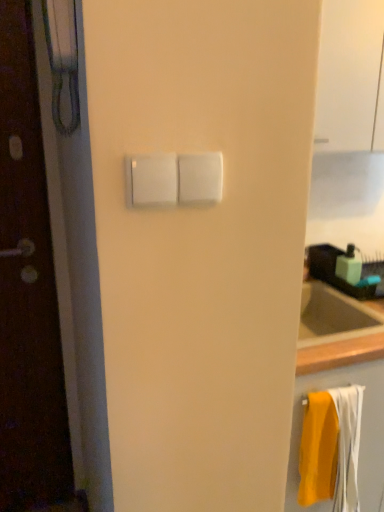
The image size is (384, 512). What do you see at coordinates (348, 73) in the screenshot?
I see `transparent glass door at upper right` at bounding box center [348, 73].

The width and height of the screenshot is (384, 512). What are the coordinates of `yellow fabric towel at lower right` in the screenshot? It's located at (331, 448).

This screenshot has height=512, width=384. In order to click on transparent glass door at upper right in this screenshot , I will do `click(348, 73)`.

Is green matte soap dispenser at upper right aimed at transparent glass door at upper right?

No, green matte soap dispenser at upper right is not aimed at transparent glass door at upper right.

Between point (358, 252) and point (342, 112), which one is positioned behind?

The point (358, 252) is behind.

From a real-world perspective, is green matte soap dispenser at upper right above or below transparent glass door at upper right?

green matte soap dispenser at upper right is situated lower than transparent glass door at upper right in the real world.

Does green matte soap dispenser at upper right have a smaller size compared to transparent glass door at upper right?

Correct, green matte soap dispenser at upper right occupies less space than transparent glass door at upper right.

From the image's perspective, which one is positioned lower, green matte soap dispenser at upper right or white plastic light switch at center?

green matte soap dispenser at upper right appears lower in the image.

Which of these two, green matte soap dispenser at upper right or white plastic light switch at center, is thinner?

white plastic light switch at center.

How many degrees apart are the facing directions of green matte soap dispenser at upper right and white plastic light switch at center?

green matte soap dispenser at upper right and white plastic light switch at center are facing 3.77 degrees away from each other.

Is green matte soap dispenser at upper right smaller than white plastic light switch at center?

No, green matte soap dispenser at upper right is not smaller than white plastic light switch at center.

Between transparent glass door at upper right and yellow fabric towel at lower right, which one appears on the left side from the viewer's perspective?

Positioned to the left is yellow fabric towel at lower right.

Where is `glass door located above the yellow fabric towel at lower right (from a real-world perspective)`? Image resolution: width=384 pixels, height=512 pixels. glass door located above the yellow fabric towel at lower right (from a real-world perspective) is located at coordinates (348, 73).

Is transparent glass door at upper right looking in the opposite direction of yellow fabric towel at lower right?

transparent glass door at upper right is not turned away from yellow fabric towel at lower right.

Is transparent glass door at upper right oriented away from white plastic light switch at center?

transparent glass door at upper right does not have its back to white plastic light switch at center.

Which of these two, transparent glass door at upper right or white plastic light switch at center, is bigger?

Bigger between the two is transparent glass door at upper right.

Consider the image. Is transparent glass door at upper right inside or outside of white plastic light switch at center?

transparent glass door at upper right is outside white plastic light switch at center.

From a real-world perspective, between white plastic light switch at center and green matte soap dispenser at upper right, who is vertically higher?

white plastic light switch at center is physically above.

Is white plastic light switch at center facing towards green matte soap dispenser at upper right?

No, white plastic light switch at center does not turn towards green matte soap dispenser at upper right.

Is white plastic light switch at center thinner than green matte soap dispenser at upper right?

Yes.

Based on the photo, are white plastic light switch at center and green matte soap dispenser at upper right making contact?

They are not placed beside each other.

Can you confirm if transparent glass door at upper right is positioned to the right of green matte soap dispenser at upper right?

In fact, transparent glass door at upper right is to the left of green matte soap dispenser at upper right.

Consider the image. Considering the sizes of objects transparent glass door at upper right and green matte soap dispenser at upper right in the image provided, who is thinner, transparent glass door at upper right or green matte soap dispenser at upper right?

green matte soap dispenser at upper right.

Which is in front, point (360, 73) or point (347, 249)?

The point (360, 73) is closer.

Is transparent glass door at upper right turned away from green matte soap dispenser at upper right?

No, transparent glass door at upper right's orientation is not away from green matte soap dispenser at upper right.

Considering the positions of objects green matte soap dispenser at upper right and yellow fabric towel at lower right in the image provided, who is more to the left, green matte soap dispenser at upper right or yellow fabric towel at lower right?

Positioned to the left is yellow fabric towel at lower right.

Is green matte soap dispenser at upper right placed right next to yellow fabric towel at lower right?

They are not placed beside each other.

In the scene shown: Is green matte soap dispenser at upper right outside of yellow fabric towel at lower right?

green matte soap dispenser at upper right is positioned outside yellow fabric towel at lower right.

From the image's perspective, which one is positioned higher, green matte soap dispenser at upper right or yellow fabric towel at lower right?

green matte soap dispenser at upper right appears higher in the image.

Where is `glass door on the left of the green matte soap dispenser at upper right`? glass door on the left of the green matte soap dispenser at upper right is located at coordinates (348, 73).

What are the coordinates of `soap dispenser that appears behind the white plastic light switch at center` in the screenshot? It's located at (349, 265).

Estimate the real-world distances between objects in this image. Which object is further from transparent glass door at upper right, green matte soap dispenser at upper right or yellow fabric towel at lower right?

The object further to transparent glass door at upper right is yellow fabric towel at lower right.

Which object lies further to the anchor point transparent glass door at upper right, yellow fabric towel at lower right or white plastic light switch at center?

yellow fabric towel at lower right lies further to transparent glass door at upper right than the other object.

Looking at the image, which one is located further to yellow fabric towel at lower right, transparent glass door at upper right or green matte soap dispenser at upper right?

The object further to yellow fabric towel at lower right is transparent glass door at upper right.

Looking at this image, when comparing their distances from yellow fabric towel at lower right, does transparent glass door at upper right or white plastic light switch at center seem closer?

transparent glass door at upper right.

Looking at the image, which one is located further to white plastic light switch at center, green matte soap dispenser at upper right or yellow fabric towel at lower right?

green matte soap dispenser at upper right is positioned further to the anchor white plastic light switch at center.

Consider the image. Looking at the image, which one is located closer to white plastic light switch at center, green matte soap dispenser at upper right or transparent glass door at upper right?

Based on the image, transparent glass door at upper right appears to be nearer to white plastic light switch at center.

Which object lies nearer to the anchor point green matte soap dispenser at upper right, yellow fabric towel at lower right or white plastic light switch at center?

The object closer to green matte soap dispenser at upper right is yellow fabric towel at lower right.

Estimate the real-world distances between objects in this image. Which object is further from white plastic light switch at center, transparent glass door at upper right or yellow fabric towel at lower right?

yellow fabric towel at lower right is further to white plastic light switch at center.

Find the location of a particular element. glass door positioned between white plastic light switch at center and green matte soap dispenser at upper right from near to far is located at coordinates (348, 73).

Where is `light switch between transparent glass door at upper right and yellow fabric towel at lower right in the vertical direction`? light switch between transparent glass door at upper right and yellow fabric towel at lower right in the vertical direction is located at coordinates (174, 179).

Where is `soap dispenser that lies between transparent glass door at upper right and yellow fabric towel at lower right from top to bottom`? soap dispenser that lies between transparent glass door at upper right and yellow fabric towel at lower right from top to bottom is located at coordinates (349, 265).

You are a GUI agent. You are given a task and a screenshot of the screen. Output one action in this format:
    pyautogui.click(x=<x>, y=<y>)
    Task: Click on the bath towel between white plastic light switch at center and green matte soap dispenser at upper right from front to back
    This screenshot has width=384, height=512.
    Given the screenshot: What is the action you would take?
    (x=331, y=448)